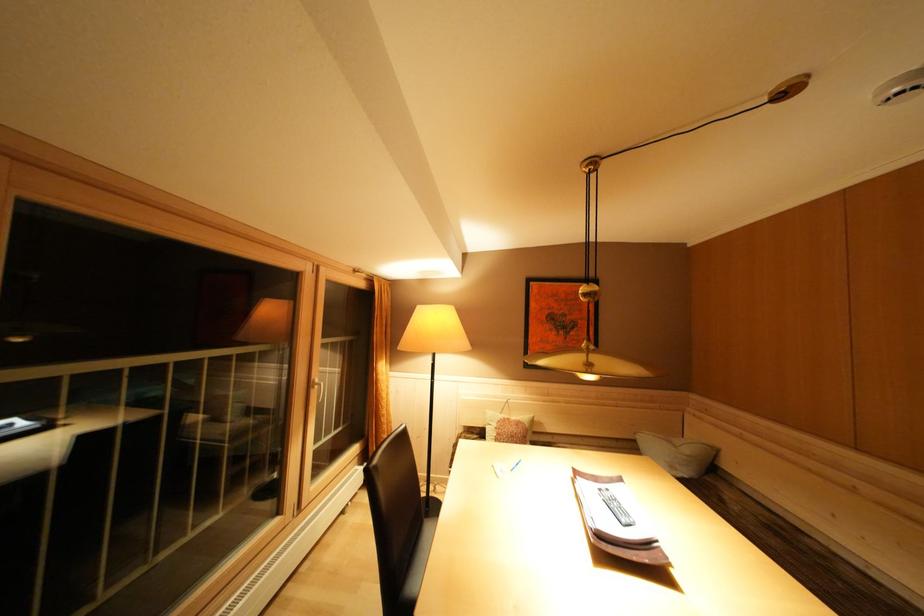
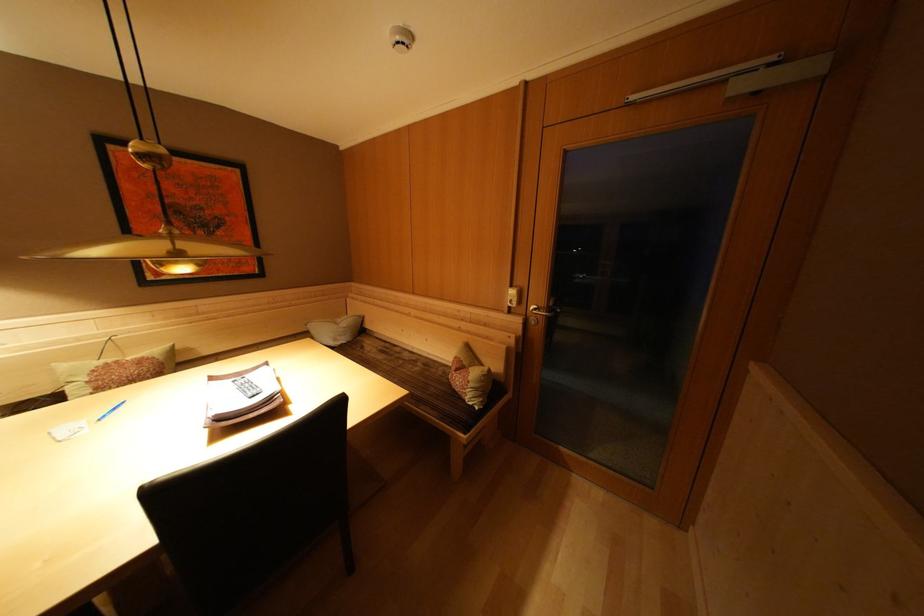
How did the camera likely rotate?

The camera's rotation is toward right-down.